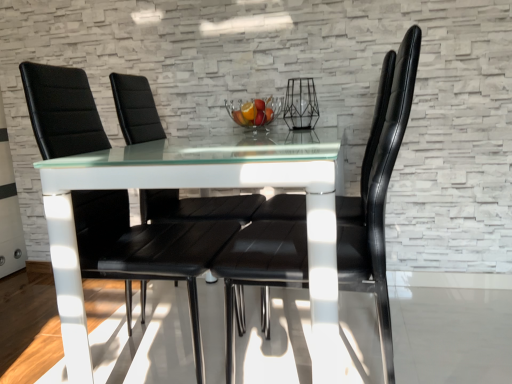
Question: Can you confirm if black leather chair at center, which is counted as the first chair, starting from the back, is smaller than black leather chair at center, which ranks as the 3th chair in back-to-front order?

Choices:
 (A) no
 (B) yes

Answer: (B)

Question: From the image's perspective, would you say black leather chair at center, which is counted as the first chair, starting from the back, is shown under black leather chair at center, which is the 1th chair in front-to-back order?

Choices:
 (A) yes
 (B) no

Answer: (B)

Question: Does black leather chair at center, which is counted as the first chair, starting from the back, have a greater width compared to black leather chair at center, which is the 1th chair in front-to-back order?

Choices:
 (A) no
 (B) yes

Answer: (A)

Question: Does black leather chair at center, which is counted as the first chair, starting from the back, appear on the right side of black leather chair at center, which ranks as the 3th chair in back-to-front order?

Choices:
 (A) yes
 (B) no

Answer: (B)

Question: Is black leather chair at center, which ranks as the 3th chair in back-to-front order, inside black leather chair at center, marked as the 3th chair in a front-to-back arrangement?

Choices:
 (A) no
 (B) yes

Answer: (A)

Question: Considering the relative sizes of black leather chair at center, which is counted as the first chair, starting from the back, and black leather chair at center, which ranks as the 3th chair in back-to-front order, in the image provided, is black leather chair at center, which is counted as the first chair, starting from the back, taller than black leather chair at center, which ranks as the 3th chair in back-to-front order,?

Choices:
 (A) no
 (B) yes

Answer: (A)

Question: Can you confirm if black leather chair at center, which is the 1th chair in front-to-back order, is smaller than clear glass bowl at center?

Choices:
 (A) no
 (B) yes

Answer: (A)

Question: From a real-world perspective, is black leather chair at center, which is the 1th chair in front-to-back order, over clear glass bowl at center?

Choices:
 (A) yes
 (B) no

Answer: (B)

Question: Does black leather chair at center, which is the 1th chair in front-to-back order, come in front of clear glass bowl at center?

Choices:
 (A) yes
 (B) no

Answer: (A)

Question: Is black leather chair at center, which ranks as the 3th chair in back-to-front order, further to the viewer compared to clear glass bowl at center?

Choices:
 (A) no
 (B) yes

Answer: (A)

Question: Can we say black leather chair at center, which ranks as the 3th chair in back-to-front order, lies outside clear glass bowl at center?

Choices:
 (A) yes
 (B) no

Answer: (A)

Question: Does black leather chair at center, which ranks as the 3th chair in back-to-front order, appear on the right side of clear glass bowl at center?

Choices:
 (A) yes
 (B) no

Answer: (A)

Question: Is clear glass bowl at center behind black leather chair at center, which is counted as the first chair, starting from the back?

Choices:
 (A) no
 (B) yes

Answer: (B)